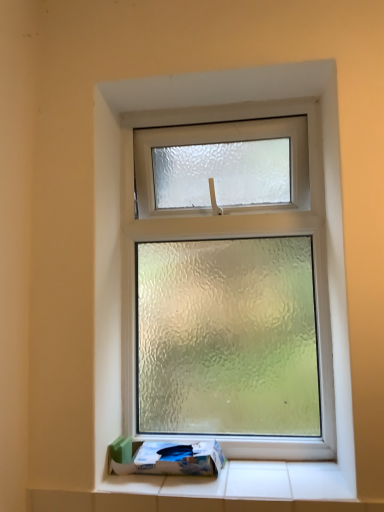
What is the approximate width of white cardboard box at bottom?

white cardboard box at bottom is 6.65 inches wide.

I want to click on white cardboard box at bottom, so click(x=165, y=458).

The width and height of the screenshot is (384, 512). What do you see at coordinates (165, 458) in the screenshot? I see `white cardboard box at bottom` at bounding box center [165, 458].

What do you see at coordinates (132, 214) in the screenshot? I see `frosted glass window at center` at bounding box center [132, 214].

This screenshot has width=384, height=512. Identify the location of frosted glass window at center. (132, 214).

What is the approximate height of frosted glass window at center?

frosted glass window at center is 1.01 meters in height.

Identify the location of white cardboard box at bottom. Image resolution: width=384 pixels, height=512 pixels. (165, 458).

Does frosted glass window at center appear on the left side of white cardboard box at bottom?

In fact, frosted glass window at center is to the right of white cardboard box at bottom.

Which object is further away from the camera, frosted glass window at center or white cardboard box at bottom?

frosted glass window at center is further from the camera.

Does point (109, 229) come farther from viewer compared to point (132, 442)?

No.

From the image's perspective, which is above, frosted glass window at center or white cardboard box at bottom?

frosted glass window at center, from the image's perspective.

From a real-world perspective, is frosted glass window at center beneath white cardboard box at bottom?

No.

Is frosted glass window at center wider or thinner than white cardboard box at bottom?

In the image, frosted glass window at center appears to be more narrow than white cardboard box at bottom.

Is frosted glass window at center taller than white cardboard box at bottom?

Yes.

Looking at this image, between frosted glass window at center and white cardboard box at bottom, which one has larger size?

frosted glass window at center.

Do you think frosted glass window at center is within white cardboard box at bottom, or outside of it?

frosted glass window at center is spatially situated outside white cardboard box at bottom.

Would you consider frosted glass window at center to be distant from white cardboard box at bottom?

No, frosted glass window at center is not far from white cardboard box at bottom.

Is frosted glass window at center oriented towards white cardboard box at bottom?

Yes, frosted glass window at center is aimed at white cardboard box at bottom.

What's the angular difference between frosted glass window at center and white cardboard box at bottom's facing directions?

There is a 1.18-degree angle between the facing directions of frosted glass window at center and white cardboard box at bottom.

Where is `box on the left of frosted glass window at center`? box on the left of frosted glass window at center is located at coordinates (165, 458).

Between white cardboard box at bottom and frosted glass window at center, which one appears on the right side from the viewer's perspective?

From the viewer's perspective, frosted glass window at center appears more on the right side.

Based on the photo, considering their positions, is white cardboard box at bottom located in front of or behind frosted glass window at center?

Clearly, white cardboard box at bottom is in front of frosted glass window at center.

Considering the positions of point (207, 450) and point (121, 243), is point (207, 450) closer or farther from the camera than point (121, 243)?

Clearly, point (207, 450) is closer to the camera than point (121, 243).

From the image's perspective, which object appears higher, white cardboard box at bottom or frosted glass window at center?

frosted glass window at center, from the image's perspective.

From a real-world perspective, is white cardboard box at bottom below frosted glass window at center?

Correct, in the physical world, white cardboard box at bottom is lower than frosted glass window at center.

Looking at this image, which of these two, white cardboard box at bottom or frosted glass window at center, is thinner?

frosted glass window at center is thinner.

Does white cardboard box at bottom have a lesser height compared to frosted glass window at center?

Correct, white cardboard box at bottom is not as tall as frosted glass window at center.

Is white cardboard box at bottom bigger than frosted glass window at center?

No, white cardboard box at bottom is not bigger than frosted glass window at center.

Does white cardboard box at bottom contain frosted glass window at center?

No, frosted glass window at center is not a part of white cardboard box at bottom.

Consider the image. Is there a large distance between white cardboard box at bottom and frosted glass window at center?

No.

Is white cardboard box at bottom oriented away from frosted glass window at center?

Yes, white cardboard box at bottom's orientation is away from frosted glass window at center.

How much distance is there between white cardboard box at bottom and frosted glass window at center?

white cardboard box at bottom and frosted glass window at center are 46.86 centimeters apart.

The width and height of the screenshot is (384, 512). In order to click on box below the frosted glass window at center (from a real-world perspective) in this screenshot , I will do `click(165, 458)`.

I want to click on box in front of the frosted glass window at center, so click(165, 458).

The height and width of the screenshot is (512, 384). I want to click on window on the right of white cardboard box at bottom, so click(x=132, y=214).